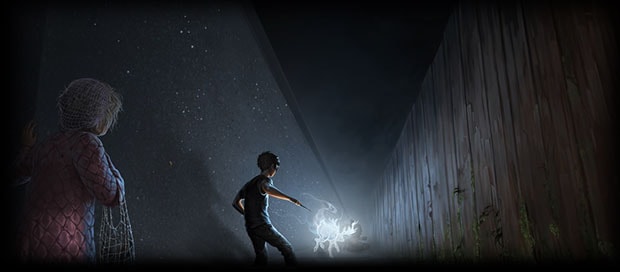
The height and width of the screenshot is (272, 620). What are the coordinates of `wall on the right` in the screenshot? It's located at (487, 126).